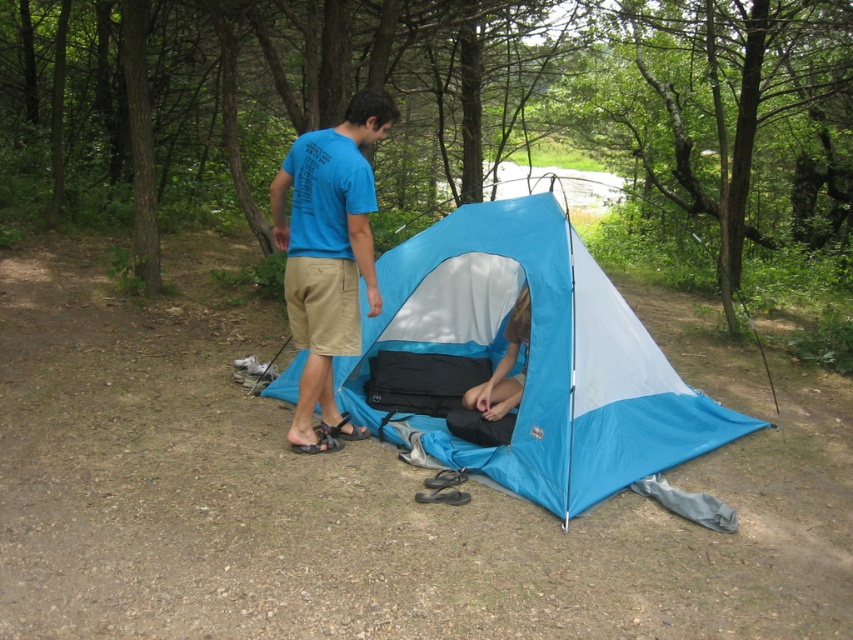
Does blue tarpaulin tent at center have a greater height compared to blue fabric tent at center?

Yes.

Measure the distance between blue tarpaulin tent at center and blue fabric tent at center.

blue tarpaulin tent at center is 21.67 inches from blue fabric tent at center.

The height and width of the screenshot is (640, 853). I want to click on blue tarpaulin tent at center, so click(x=540, y=364).

You are a GUI agent. You are given a task and a screenshot of the screen. Output one action in this format:
    pyautogui.click(x=<x>, y=<y>)
    Task: Click on the blue tarpaulin tent at center
    
    Given the screenshot: What is the action you would take?
    pyautogui.click(x=540, y=364)

Between blue tarpaulin tent at center and blue cotton t-shirt at center, which one appears on the right side from the viewer's perspective?

blue tarpaulin tent at center

Is blue tarpaulin tent at center taller than blue cotton t-shirt at center?

No.

Describe the element at coordinates (540, 364) in the screenshot. I see `blue tarpaulin tent at center` at that location.

This screenshot has width=853, height=640. Find the location of `blue tarpaulin tent at center`. blue tarpaulin tent at center is located at coordinates (540, 364).

Based on the photo, who is positioned more to the right, blue cotton t-shirt at center or blue fabric tent at center?

blue fabric tent at center

The height and width of the screenshot is (640, 853). Describe the element at coordinates (328, 257) in the screenshot. I see `blue cotton t-shirt at center` at that location.

At what (x,y) coordinates should I click in order to perform the action: click on blue cotton t-shirt at center. Please return your answer as a coordinate pair (x, y). Looking at the image, I should click on (328, 257).